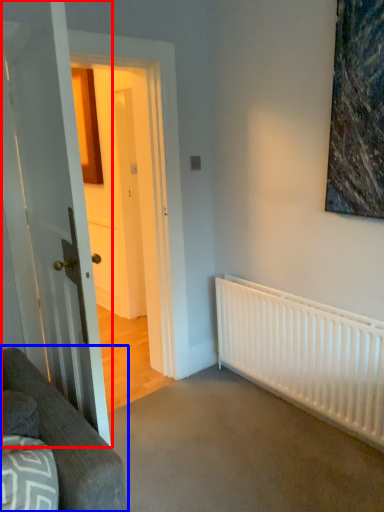
Question: Which point is further to the camera, door (highlighted by a red box) or studio couch (highlighted by a blue box)?

Choices:
 (A) door
 (B) studio couch

Answer: (A)